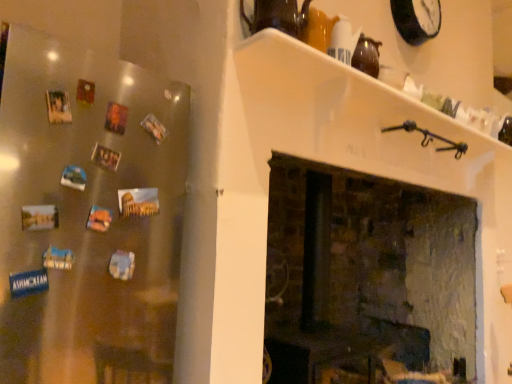
Question: From a real-world perspective, does white glossy shelf at upper center sit lower than rustic brick fireplace at center?

Choices:
 (A) no
 (B) yes

Answer: (A)

Question: From the image's perspective, does white glossy shelf at upper center appear higher than rustic brick fireplace at center?

Choices:
 (A) yes
 (B) no

Answer: (A)

Question: Is white glossy shelf at upper center not within rustic brick fireplace at center?

Choices:
 (A) yes
 (B) no

Answer: (A)

Question: Considering the relative sizes of white glossy shelf at upper center and rustic brick fireplace at center in the image provided, is white glossy shelf at upper center smaller than rustic brick fireplace at center?

Choices:
 (A) no
 (B) yes

Answer: (B)

Question: Is white glossy shelf at upper center to the right of rustic brick fireplace at center from the viewer's perspective?

Choices:
 (A) yes
 (B) no

Answer: (A)

Question: Is the position of white glossy shelf at upper center more distant than that of rustic brick fireplace at center?

Choices:
 (A) yes
 (B) no

Answer: (B)

Question: Is white glossy shelf at upper center positioned before matte brown teapot at upper center?

Choices:
 (A) yes
 (B) no

Answer: (A)

Question: Is white glossy shelf at upper center aimed at matte brown teapot at upper center?

Choices:
 (A) yes
 (B) no

Answer: (B)

Question: Is white glossy shelf at upper center at the left side of matte brown teapot at upper center?

Choices:
 (A) no
 (B) yes

Answer: (A)

Question: Can you confirm if white glossy shelf at upper center is smaller than matte brown teapot at upper center?

Choices:
 (A) no
 (B) yes

Answer: (A)

Question: Is white glossy shelf at upper center shorter than matte brown teapot at upper center?

Choices:
 (A) no
 (B) yes

Answer: (A)

Question: Is there a large distance between white glossy shelf at upper center and matte brown teapot at upper center?

Choices:
 (A) no
 (B) yes

Answer: (A)

Question: Can you confirm if black plastic clock at upper right is wider than white glossy shelf at upper center?

Choices:
 (A) yes
 (B) no

Answer: (B)